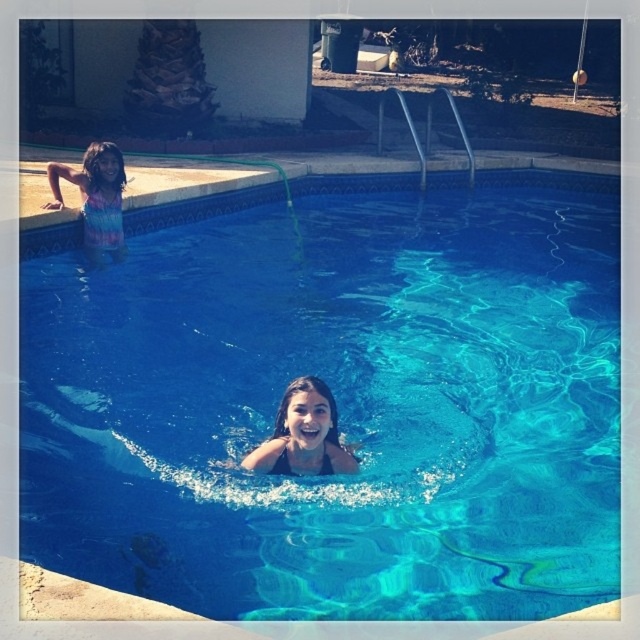
You are standing at the edge of the pool and want to reach both the point at coordinates point (317,353) and the point at coordinates point (268,438). Which point is closer to you?

Point (317,353) is closer to you because it is further to the viewer than point (268,438).